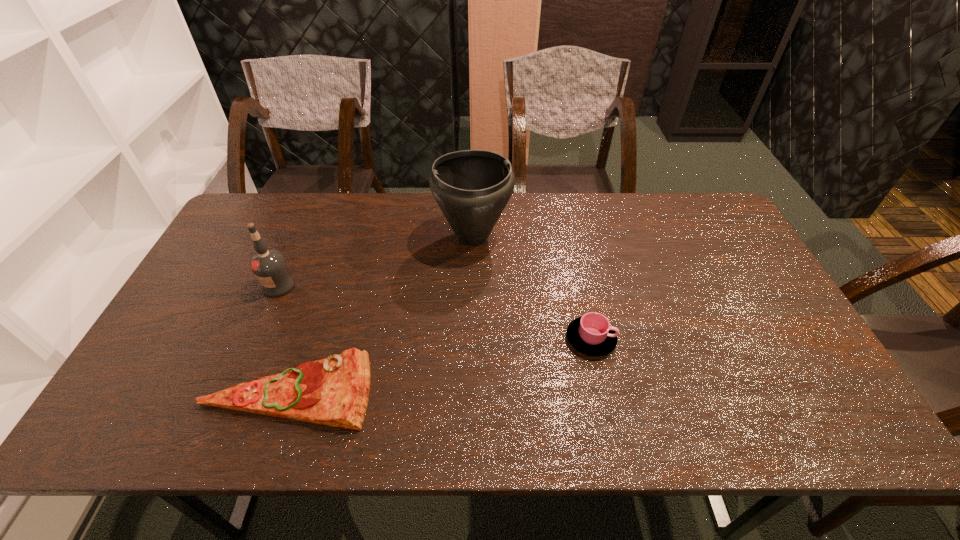
Where is `the second object from right to left`? This screenshot has height=540, width=960. the second object from right to left is located at coordinates (472, 187).

Find the location of a particular element. This screenshot has height=540, width=960. urn is located at coordinates (472, 187).

Where is `the third shortest object`? the third shortest object is located at coordinates (269, 266).

Image resolution: width=960 pixels, height=540 pixels. I want to click on the second farthest object, so click(x=269, y=266).

At what (x,y) coordinates should I click in order to perform the action: click on cup. Please return your answer as a coordinate pair (x, y). Image resolution: width=960 pixels, height=540 pixels. Looking at the image, I should click on (592, 335).

This screenshot has width=960, height=540. Identify the location of the second shortest object. (592, 335).

Find the location of `the shortest object`. the shortest object is located at coordinates (334, 391).

The height and width of the screenshot is (540, 960). I want to click on blank space located 0.350m on the front of the farthest object, so click(x=471, y=361).

Locate an element on the screen. free region located on the front label of the third nearest object is located at coordinates (240, 376).

You are a GUI agent. You are given a task and a screenshot of the screen. Output one action in this format:
    pyautogui.click(x=<x>, y=<y>)
    Task: Click on the vacant space located 0.120m on the side with the handle of the cup
    This screenshot has width=960, height=540.
    Given the screenshot: What is the action you would take?
    pyautogui.click(x=662, y=339)